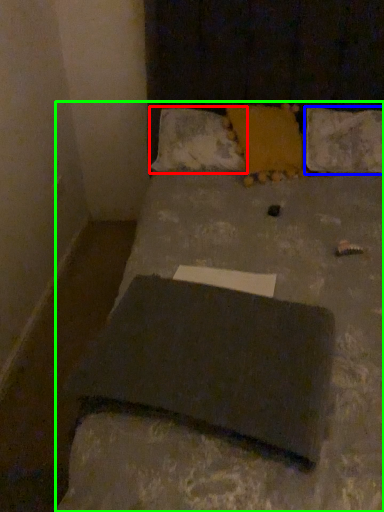
Question: Based on their relative distances, which object is nearer to pillow (highlighted by a red box)? Choose from pillow (highlighted by a blue box) and bed (highlighted by a green box).

Choices:
 (A) pillow
 (B) bed

Answer: (A)